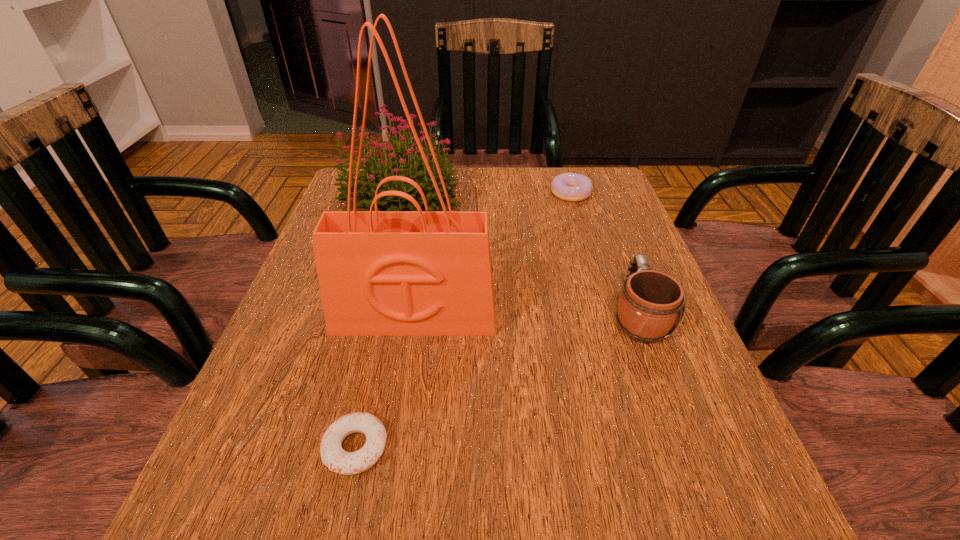
Identify the location of tote bag. (381, 273).

The height and width of the screenshot is (540, 960). Identify the location of the second tallest object. (396, 163).

This screenshot has width=960, height=540. I want to click on mug, so click(651, 302).

What are the coordinates of `the taller doughnut` in the screenshot? It's located at (572, 187).

The width and height of the screenshot is (960, 540). In order to click on the farther doughnut in this screenshot , I will do `click(572, 187)`.

Locate an element on the screen. The image size is (960, 540). the left doughnut is located at coordinates (333, 456).

Find the location of a particular element. The height and width of the screenshot is (540, 960). the nearer doughnut is located at coordinates (333, 456).

Image resolution: width=960 pixels, height=540 pixels. I want to click on vacant position located on the logo side of the tallest object, so click(391, 470).

Identify the location of vacant space positioned on the front of the fourth shortest object. The height and width of the screenshot is (540, 960). (359, 357).

Find the location of a particular element. vacant space located on the side of the mug with the handle is located at coordinates click(x=589, y=186).